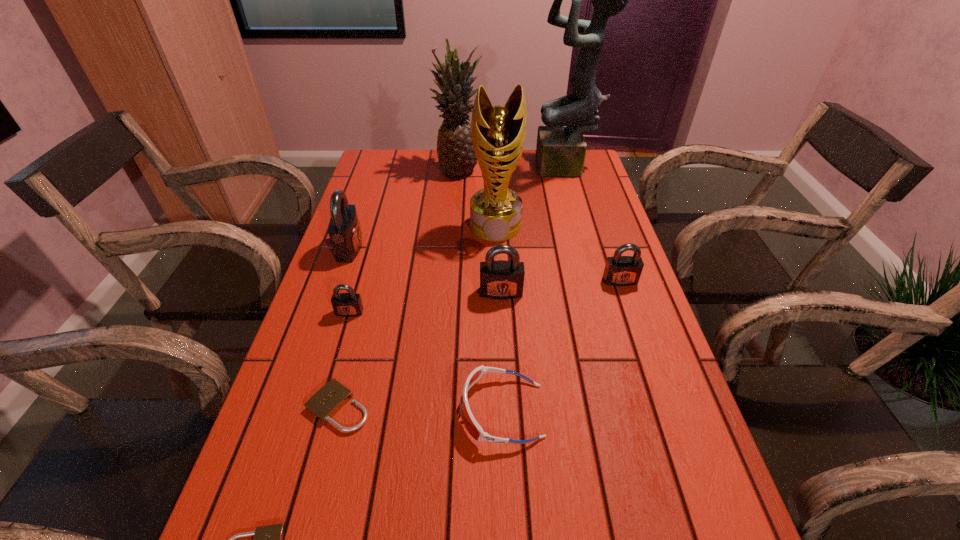
I want to click on free space between the gray sculpture and the goggles, so click(534, 290).

I want to click on empty space that is in between the red goggles and the tallest padlock, so click(426, 329).

Where is `unoccupied position between the second smallest gray padlock and the farther beige padlock`? unoccupied position between the second smallest gray padlock and the farther beige padlock is located at coordinates (479, 344).

Find the location of a particular element. empty space that is in between the red goggles and the third nearest padlock is located at coordinates coord(425,361).

The image size is (960, 540). Identify the location of object that stands as the sixth closest to the biggest gray padlock. (475, 430).

Locate which object ranks fifth in proximity to the smaller beige padlock. Please provide its 2D coordinates. Your answer should be formatted as a tuple, i.e. [(x, y)], where the tuple contains the x and y coordinates of a point satisfying the conditions above.

[(344, 230)]

Point out which padlock is positioned as the third nearest to the gray sculpture. Please provide its 2D coordinates. Your answer should be formatted as a tuple, i.e. [(x, y)], where the tuple contains the x and y coordinates of a point satisfying the conditions above.

[(344, 230)]

What are the coordinates of `padlock that is the third closest one to the seventh farthest object` in the screenshot? It's located at (501, 279).

Identify the location of gray padlock that is the third closest one to the sculpture. The height and width of the screenshot is (540, 960). (344, 230).

The width and height of the screenshot is (960, 540). What are the coordinates of `gray padlock that is the second closest one to the award` in the screenshot? It's located at (619, 270).